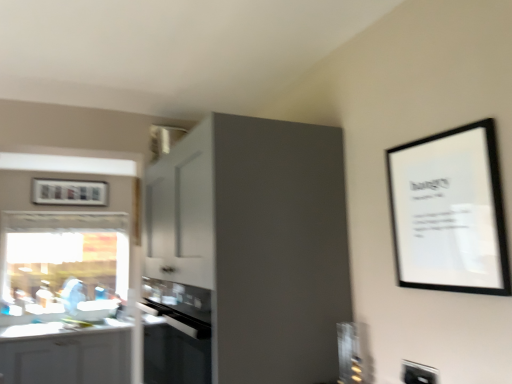
Question: From the image's perspective, is black glass oven at center under white glossy cabinet at lower left, the 1th cabinetry positioned from the left?

Choices:
 (A) yes
 (B) no

Answer: (B)

Question: From a real-world perspective, is black glass oven at center beneath white glossy cabinet at lower left, the 1th cabinetry positioned from the left?

Choices:
 (A) no
 (B) yes

Answer: (A)

Question: Considering the relative sizes of black glass oven at center and white glossy cabinet at lower left, arranged as the second cabinetry when viewed from the right, in the image provided, is black glass oven at center wider than white glossy cabinet at lower left, arranged as the second cabinetry when viewed from the right,?

Choices:
 (A) no
 (B) yes

Answer: (A)

Question: Is there a large distance between black glass oven at center and white glossy cabinet at lower left, arranged as the second cabinetry when viewed from the right?

Choices:
 (A) no
 (B) yes

Answer: (B)

Question: Is black glass oven at center aimed at white glossy cabinet at lower left, arranged as the second cabinetry when viewed from the right?

Choices:
 (A) no
 (B) yes

Answer: (A)

Question: Is black glass oven at center to the left of white glossy cabinet at lower left, positioned as the 1th cabinetry in bottom-to-top order, from the viewer's perspective?

Choices:
 (A) no
 (B) yes

Answer: (A)

Question: From the image's perspective, would you say white glossy countertop at lower left is shown under black matte picture frame at upper right, which appears as the 2th picture frame when viewed from the left?

Choices:
 (A) no
 (B) yes

Answer: (B)

Question: Can you confirm if white glossy countertop at lower left is positioned to the right of black matte picture frame at upper right, which is the 1th picture frame from front to back?

Choices:
 (A) no
 (B) yes

Answer: (A)

Question: Considering the relative sizes of white glossy countertop at lower left and black matte picture frame at upper right, which is the 1th picture frame from front to back, in the image provided, is white glossy countertop at lower left taller than black matte picture frame at upper right, which is the 1th picture frame from front to back,?

Choices:
 (A) no
 (B) yes

Answer: (A)

Question: Is there a large distance between white glossy countertop at lower left and black matte picture frame at upper right, which appears as the 2th picture frame when viewed from the left?

Choices:
 (A) no
 (B) yes

Answer: (B)

Question: Does white glossy countertop at lower left have a smaller size compared to black matte picture frame at upper right, arranged as the second picture frame when viewed from the back?

Choices:
 (A) yes
 (B) no

Answer: (B)

Question: Can you confirm if white glossy countertop at lower left is positioned to the left of black matte picture frame at upper right, placed as the 1th picture frame when sorted from right to left?

Choices:
 (A) yes
 (B) no

Answer: (A)

Question: Is white plastic electric outlet at lower right inside black glass oven at center?

Choices:
 (A) yes
 (B) no

Answer: (B)